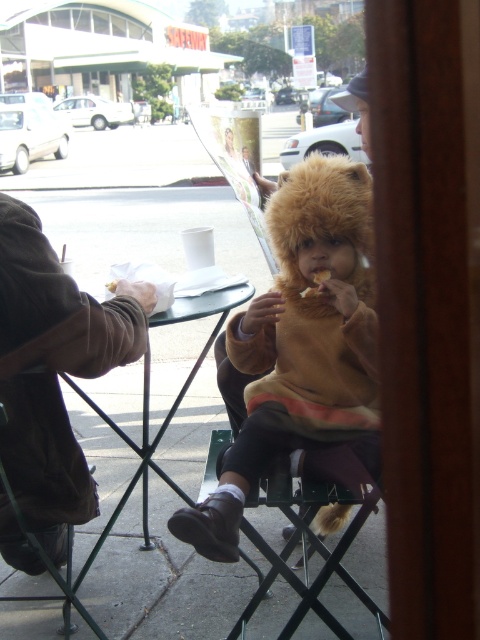
Question: Where is brown leather jacket at left located in relation to metallic green stool at lower center in the image?

Choices:
 (A) above
 (B) below

Answer: (A)

Question: Based on their relative distances, which object is nearer to the golden crispy cracker at center?

Choices:
 (A) green plastic table at center
 (B) golden brown crumb at center

Answer: (B)

Question: Which object appears farthest from the camera in this image?

Choices:
 (A) brown leather jacket at left
 (B) golden brown crumb at center
 (C) fuzzy brown hat at center
 (D) golden crispy cracker at center

Answer: (B)

Question: Is brown leather jacket at left wider than golden brown crumb at center?

Choices:
 (A) yes
 (B) no

Answer: (A)

Question: Can you confirm if green plastic table at center is wider than metallic green stool at lower center?

Choices:
 (A) no
 (B) yes

Answer: (B)

Question: Which of the following is the closest to the observer?

Choices:
 (A) (314, 282)
 (B) (336, 160)
 (C) (328, 272)
 (D) (189, 300)

Answer: (C)